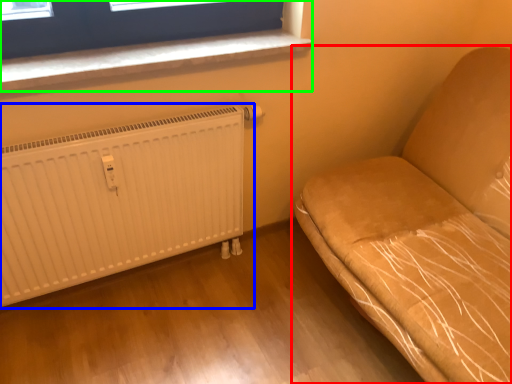
Question: Considering the real-world distances, which object is closest to furniture (highlighted by a red box)? radiator (highlighted by a blue box) or window (highlighted by a green box).

Choices:
 (A) radiator
 (B) window

Answer: (A)